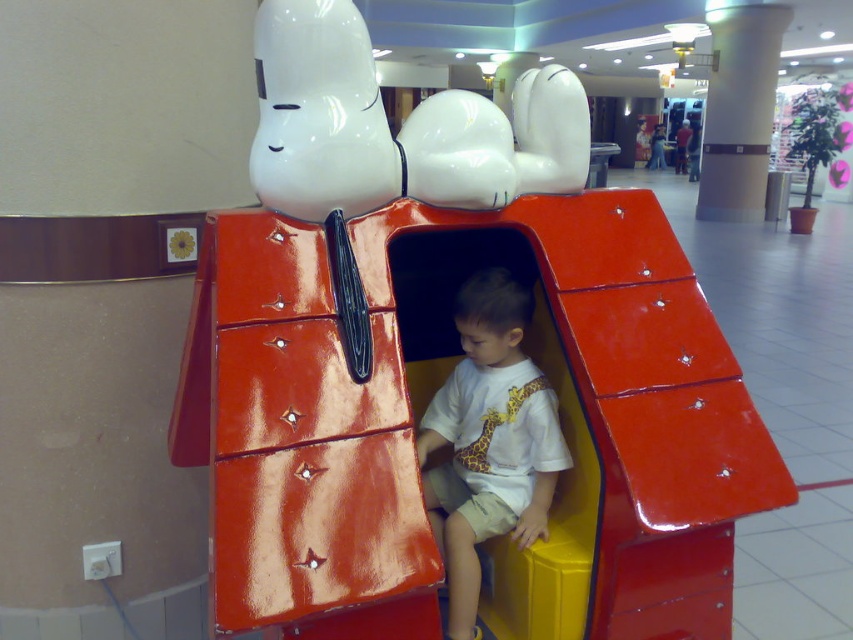
Question: Does white glossy snoopy at upper center appear over white matte shirt at center?

Choices:
 (A) yes
 (B) no

Answer: (A)

Question: Which point is closer to the camera?

Choices:
 (A) click(x=393, y=196)
 (B) click(x=720, y=74)
 (C) click(x=473, y=428)

Answer: (A)

Question: Based on their relative distances, which object is nearer to the white glossy pillar at center?

Choices:
 (A) white matte shirt at center
 (B) white glossy snoopy at upper center

Answer: (B)

Question: Does white glossy snoopy at upper center have a greater width compared to white glossy pillar at center?

Choices:
 (A) yes
 (B) no

Answer: (B)

Question: Is white glossy snoopy at upper center behind white glossy pillar at center?

Choices:
 (A) yes
 (B) no

Answer: (B)

Question: Among these points, which one is nearest to the camera?

Choices:
 (A) (778, 24)
 (B) (515, 120)

Answer: (B)